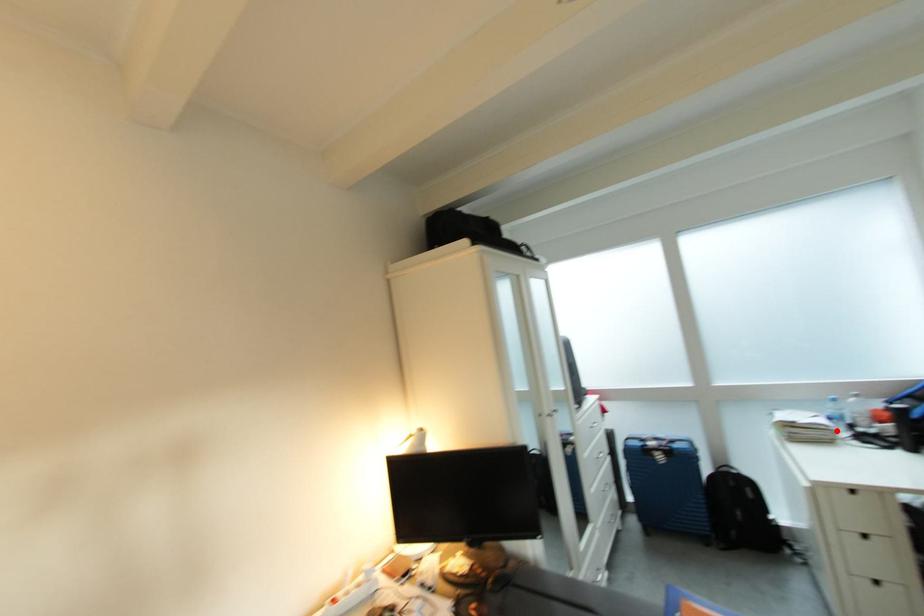
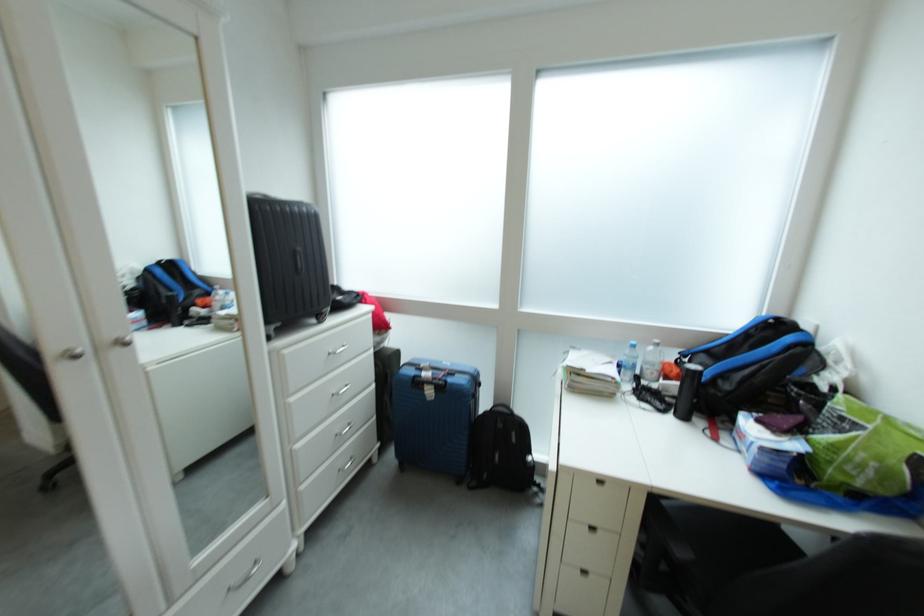
Locate, in the second image, the point that corresponds to the highlighted location in the first image.

(622, 383)